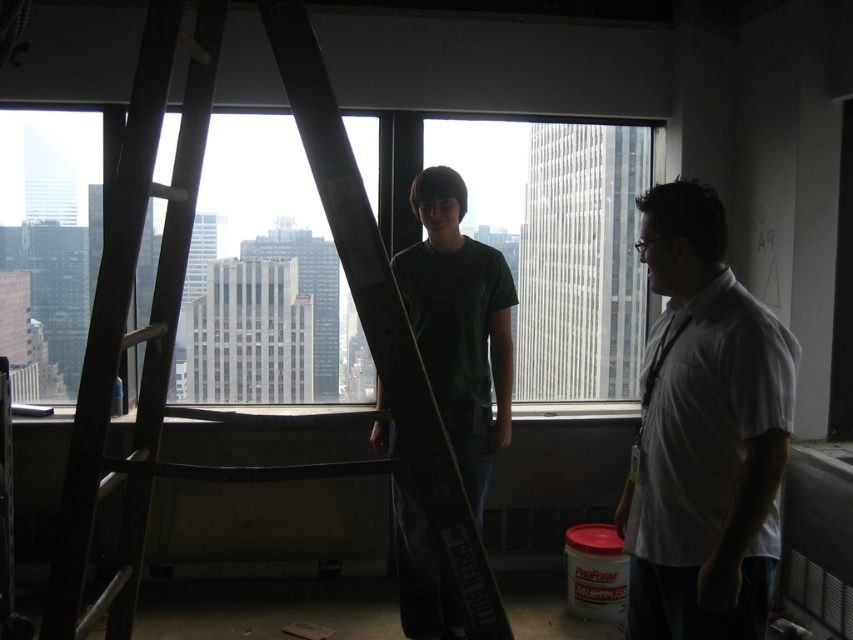
Question: Is transparent glass window at center bigger than wooden ladder at center?

Choices:
 (A) no
 (B) yes

Answer: (A)

Question: Which object appears farthest from the camera in this image?

Choices:
 (A) green matte t-shirt at center
 (B) transparent glass window at center
 (C) white shirt at right
 (D) wooden ladder at center

Answer: (B)

Question: Considering the relative positions of transparent glass window at center and wooden ladder at center in the image provided, where is transparent glass window at center located with respect to wooden ladder at center?

Choices:
 (A) below
 (B) above

Answer: (B)

Question: Can you confirm if white shirt at right is positioned below green matte t-shirt at center?

Choices:
 (A) no
 (B) yes

Answer: (A)

Question: Which point is closer to the camera?

Choices:
 (A) (177, 243)
 (B) (285, 132)

Answer: (A)

Question: Based on their relative distances, which object is nearer to the wooden ladder at center?

Choices:
 (A) transparent glass window at center
 (B) green matte t-shirt at center
 (C) white shirt at right

Answer: (C)